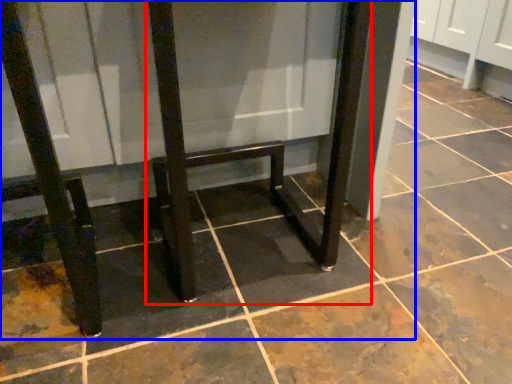
Question: Among these objects, which one is nearest to the camera, furniture (highlighted by a red box) or furniture (highlighted by a blue box)?

Choices:
 (A) furniture
 (B) furniture

Answer: (B)